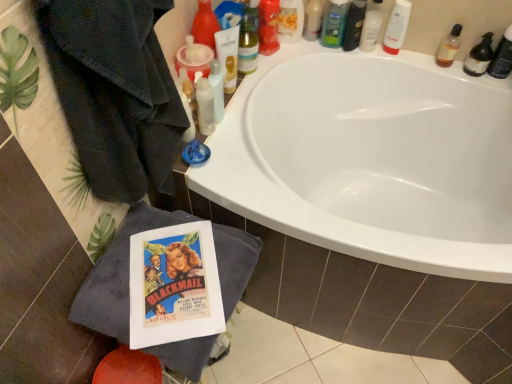
The image size is (512, 384). In order to click on blank space situated above gray cotton bath towel at lower left (from a real-world perspective) in this screenshot , I will do `click(173, 268)`.